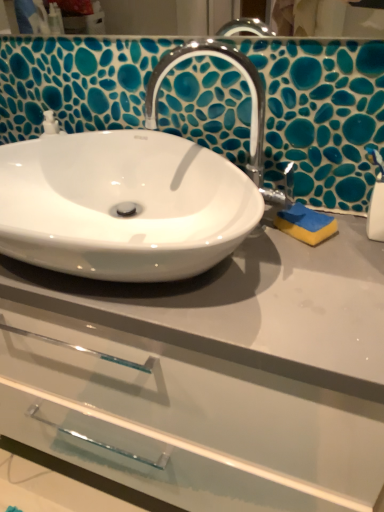
The height and width of the screenshot is (512, 384). What are the coordinates of `free point in front of yellow sponge at right` in the screenshot? It's located at (312, 284).